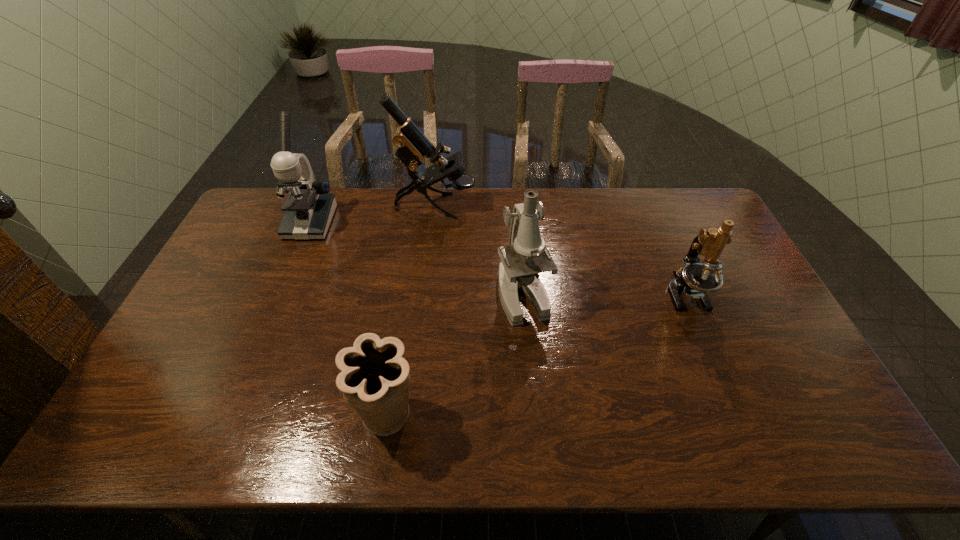
This screenshot has width=960, height=540. Identify the location of free space located 0.350m at the eyepiece of the second shortest object. (747, 436).

What are the coordinates of `free space located on the left of the shortest object` in the screenshot? It's located at (296, 416).

Identify the location of object that is at the near edge. This screenshot has width=960, height=540. (375, 380).

The height and width of the screenshot is (540, 960). Identify the location of free region at the far edge of the desktop. (352, 220).

In the image, there is a desktop. Identify the location of vacant space at the near edge. The image size is (960, 540). (515, 446).

Where is `vacant area at the left edge`? The height and width of the screenshot is (540, 960). vacant area at the left edge is located at coordinates (186, 357).

The height and width of the screenshot is (540, 960). What are the coordinates of `vacant area at the right edge of the desktop` in the screenshot? It's located at (694, 230).

Locate an element on the screen. The image size is (960, 540). free space at the near left corner is located at coordinates [x=118, y=428].

Locate an element on the screen. This screenshot has height=540, width=960. vacant area at the near right corner is located at coordinates (779, 441).

You are a GUI agent. You are given a task and a screenshot of the screen. Output one action in this format:
    pyautogui.click(x=<x>, y=<y>)
    Task: Click on the vacant space that is in between the second object from right to left and the shortest object
    The height and width of the screenshot is (540, 960).
    Given the screenshot: What is the action you would take?
    pyautogui.click(x=455, y=355)